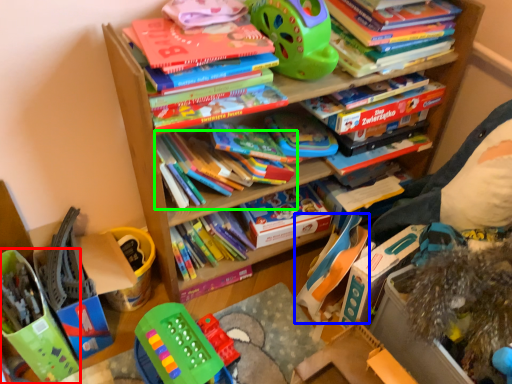
Question: Based on their relative distances, which object is nearer to toy (highlighted by a red box)? Choose from toy (highlighted by a blue box) and book (highlighted by a green box).

Choices:
 (A) toy
 (B) book

Answer: (B)